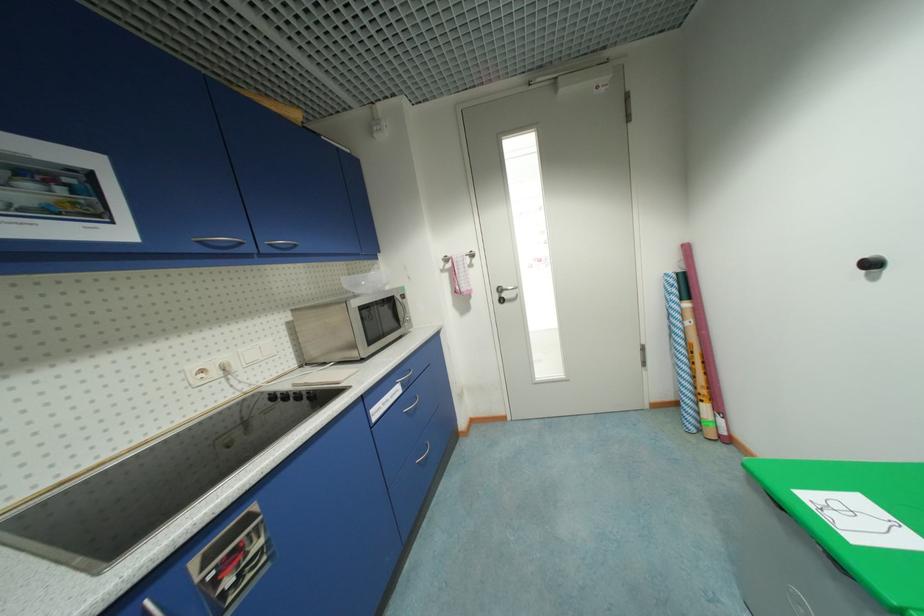
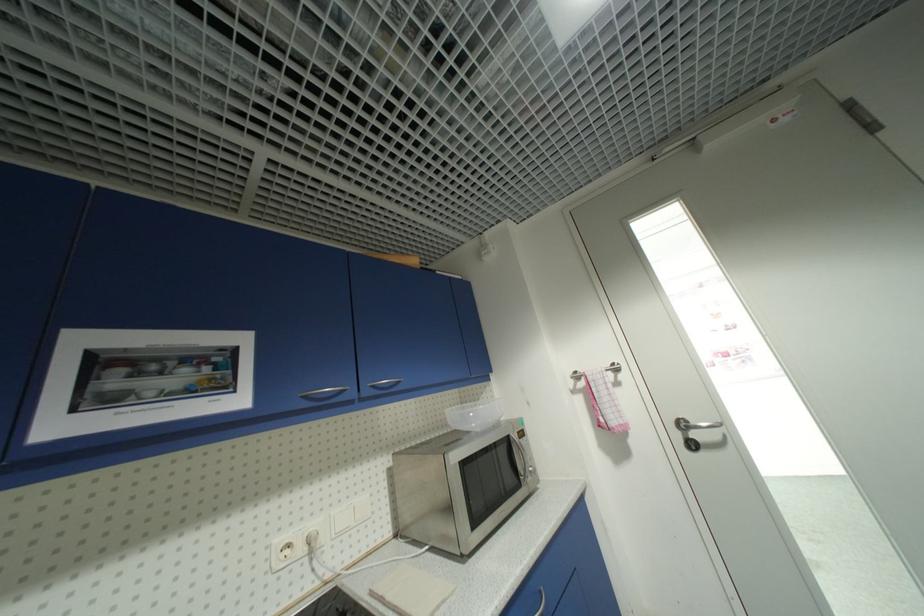
In the second image, find the point that corresponds to point (505, 291) in the first image.

(688, 426)